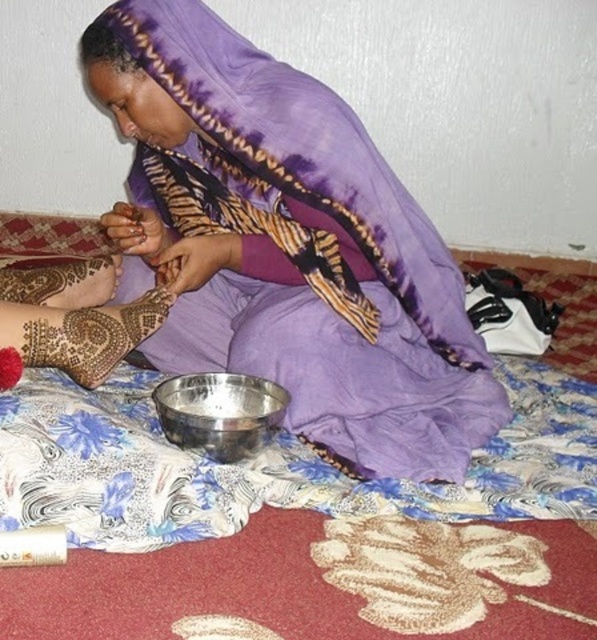
Question: Does brown mehendi art at lower left have a greater width compared to brown henna at center?

Choices:
 (A) no
 (B) yes

Answer: (B)

Question: Which of the following is the farthest from the observer?

Choices:
 (A) brown mehendi art at lower left
 (B) brown matte henna at center

Answer: (A)

Question: Estimate the real-world distances between objects in this image. Which object is closer to the brown henna at center?

Choices:
 (A) brown mehendi art at lower left
 (B) purple satin scarf at upper center
 (C) metallic silver bowl at center

Answer: (B)

Question: Based on their relative distances, which object is farther from the brown mehendi art at lower left?

Choices:
 (A) brown henna at center
 (B) brown matte henna at center

Answer: (A)

Question: Is brown mehendi art at lower left in front of brown henna at center?

Choices:
 (A) yes
 (B) no

Answer: (B)

Question: Is metallic silver bowl at center above brown henna at center?

Choices:
 (A) no
 (B) yes

Answer: (A)